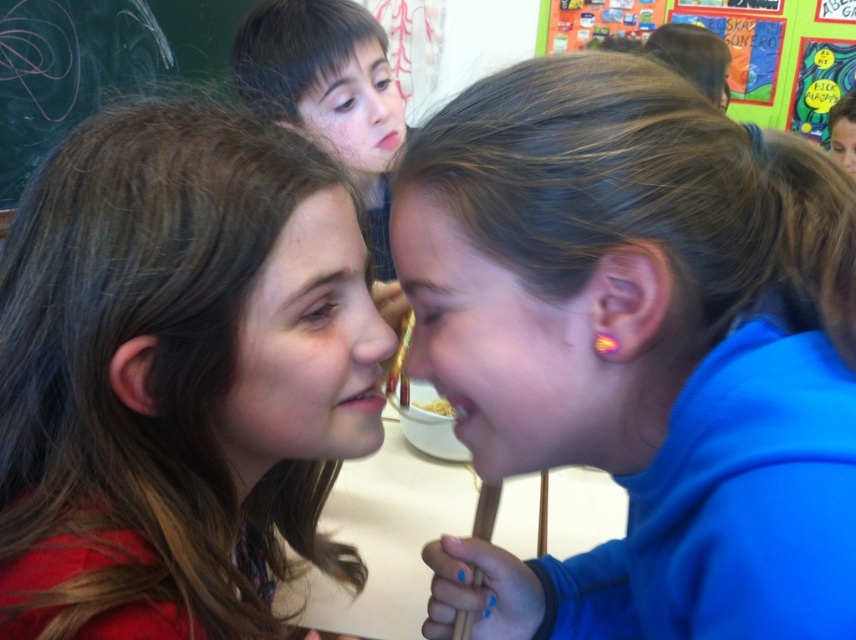
You are a chef trying to decide where to place a new menu board. You see the chalkboard at upper left and the yellow matte pasta at center. Which object is wider?

The chalkboard at upper left might be wider than yellow matte pasta at center according to the description.

You are a photographer trying to capture the best angle of the two girls. You want to ensure that the blue fabric at center and the matte blue ear at center are both visible in the shot. Based on their positions, which object should you focus on first to frame the shot properly?

The blue fabric at center is located below the matte blue ear at center, so you should focus on the matte blue ear at center first to ensure both objects are in frame.